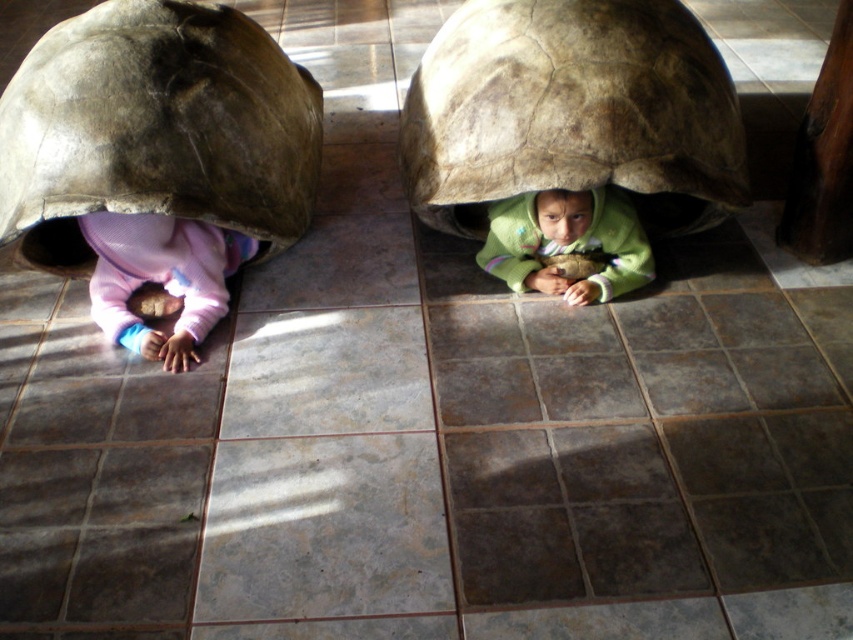
You are a zookeeper who needs to ensure the safety of the children playing near the tortoises. The children are wearing a pink fleece baby at lower left and a green fleece jacket at center. What is the minimum safe distance required between the children to prevent them from being accidentally stepped on by the tortoises?

The minimum safe distance between the pink fleece baby at lower left and the green fleece jacket at center should be at least 90.94 centimeters to prevent them from being accidentally stepped on by the tortoises.

You are a zookeeper who needs to locate the green fleece jacket at center. Based on the scene, where should you look relative to the matte brown tortoise shell at lower left?

The green fleece jacket at center is on the right side of the matte brown tortoise shell at lower left.